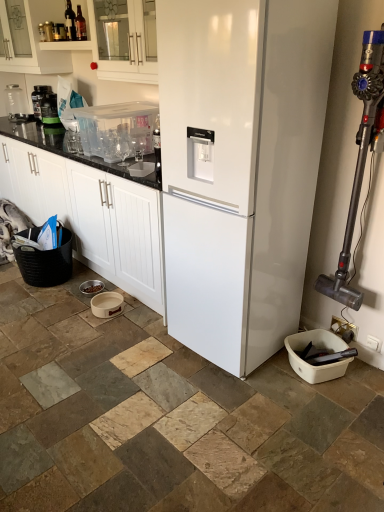
What do you see at coordinates (15, 103) in the screenshot?
I see `clear plastic container at upper left, acting as the seventh appliance starting from the right` at bounding box center [15, 103].

This screenshot has height=512, width=384. What are the coordinates of `white plastic bucket at lower right, positioned as the 2th appliance in front-to-back order` in the screenshot? It's located at (320, 345).

Identify the location of matte black coffee maker at left, placed as the fifth appliance when sorted from right to left. (49, 110).

What do you see at coordinates (49, 110) in the screenshot? I see `matte black coffee maker at left, which ranks as the third appliance in back-to-front order` at bounding box center [49, 110].

You are a GUI agent. You are given a task and a screenshot of the screen. Output one action in this format:
    pyautogui.click(x=<x>, y=<y>)
    Task: Click on the transparent plastic container at upper left, placed as the fifth appliance when sorted from left to right
    The image size is (384, 512).
    Given the screenshot: What is the action you would take?
    pyautogui.click(x=117, y=129)

Is black woven basket at lower left positioned beyond the bounds of matte glass cabinet at upper left, which ranks as the third cabinetry in bottom-to-top order?

Yes, black woven basket at lower left is located beyond the bounds of matte glass cabinet at upper left, which ranks as the third cabinetry in bottom-to-top order.

Measure the distance between black woven basket at lower left and matte glass cabinet at upper left, which appears as the first cabinetry when viewed from the top.

black woven basket at lower left is 1.66 meters from matte glass cabinet at upper left, which appears as the first cabinetry when viewed from the top.

Looking at this image, which is closer, (35, 230) or (29, 56)?

Point (35, 230) is closer to the camera than point (29, 56).

Is black woven basket at lower left in front of or behind matte glass cabinet at upper left, which appears as the first cabinetry when viewed from the top, in the image?

Visually, black woven basket at lower left is located in front of matte glass cabinet at upper left, which appears as the first cabinetry when viewed from the top.

Does beige ceramic bowl at lower center, positioned as the fourth appliance in back-to-front order, have a greater height compared to dark glass bottle at upper left?

In fact, beige ceramic bowl at lower center, positioned as the fourth appliance in back-to-front order, may be shorter than dark glass bottle at upper left.

Does beige ceramic bowl at lower center, positioned as the fourth appliance in back-to-front order, have a greater width compared to dark glass bottle at upper left?

Yes.

What's the angular difference between beige ceramic bowl at lower center, which is the fourth appliance in right-to-left order, and dark glass bottle at upper left's facing directions?

0.285 degrees.

Is beige ceramic bowl at lower center, positioned as the fourth appliance in back-to-front order, next to dark glass bottle at upper left and touching it?

There is a gap between beige ceramic bowl at lower center, positioned as the fourth appliance in back-to-front order, and dark glass bottle at upper left.

Is metallic gray vacuum cleaner at right, the 1th appliance in the front-to-back sequence, facing towards matte black protein powder container at upper left, the 6th appliance when ordered from right to left?

No, metallic gray vacuum cleaner at right, the 1th appliance in the front-to-back sequence, is not facing towards matte black protein powder container at upper left, the 6th appliance when ordered from right to left.

Can you confirm if metallic gray vacuum cleaner at right, arranged as the 7th appliance when viewed from the left, is positioned to the right of matte black protein powder container at upper left, which appears as the sixth appliance when viewed from the front?

Yes, metallic gray vacuum cleaner at right, arranged as the 7th appliance when viewed from the left, is to the right of matte black protein powder container at upper left, which appears as the sixth appliance when viewed from the front.

Considering the relative sizes of metallic gray vacuum cleaner at right, which ranks as the first appliance in right-to-left order, and matte black protein powder container at upper left, the 6th appliance when ordered from right to left, in the image provided, is metallic gray vacuum cleaner at right, which ranks as the first appliance in right-to-left order, taller than matte black protein powder container at upper left, the 6th appliance when ordered from right to left,?

Yes, metallic gray vacuum cleaner at right, which ranks as the first appliance in right-to-left order, is taller than matte black protein powder container at upper left, the 6th appliance when ordered from right to left.

From a real-world perspective, is metallic gray vacuum cleaner at right, arranged as the 7th appliance when viewed from the left, positioned above or below matte black protein powder container at upper left, the 6th appliance when ordered from right to left?

metallic gray vacuum cleaner at right, arranged as the 7th appliance when viewed from the left, is situated lower than matte black protein powder container at upper left, the 6th appliance when ordered from right to left, in the real world.

Where is `refrigerator in front of the transparent plastic container at upper left, arranged as the third appliance when viewed from the right`? The image size is (384, 512). refrigerator in front of the transparent plastic container at upper left, arranged as the third appliance when viewed from the right is located at coordinates (240, 167).

Is transparent plastic container at upper left, arranged as the third appliance when viewed from the right, wider or thinner than white glossy refrigerator at center?

transparent plastic container at upper left, arranged as the third appliance when viewed from the right, is thinner than white glossy refrigerator at center.

Is point (107, 114) closer or farther from the camera than point (187, 311)?

Point (107, 114) appears to be farther away from the viewer than point (187, 311).

Between transparent plastic container at upper left, arranged as the fifth appliance when viewed from the back, and white glossy refrigerator at center, which one has more height?

white glossy refrigerator at center.

Is matte glass cabinet at upper left, which ranks as the third cabinetry in bottom-to-top order, looking in the opposite direction of white glossy refrigerator at center?

No, matte glass cabinet at upper left, which ranks as the third cabinetry in bottom-to-top order, is not facing away from white glossy refrigerator at center.

In terms of height, does matte glass cabinet at upper left, which ranks as the third cabinetry in bottom-to-top order, look taller or shorter compared to white glossy refrigerator at center?

Considering their sizes, matte glass cabinet at upper left, which ranks as the third cabinetry in bottom-to-top order, has less height than white glossy refrigerator at center.

From the image's perspective, is matte glass cabinet at upper left, which appears as the first cabinetry when viewed from the top, located above white glossy refrigerator at center?

Yes, from the image's perspective, matte glass cabinet at upper left, which appears as the first cabinetry when viewed from the top, is above white glossy refrigerator at center.

Can you tell me how much matte glass cabinet at upper left, which ranks as the third cabinetry in bottom-to-top order, and white glossy refrigerator at center differ in facing direction?

They differ by 0.000142 degrees in their facing directions.

From a real-world perspective, does black woven basket at lower left stand above clear plastic container at upper left, acting as the seventh appliance starting from the right?

No, from a real-world perspective, black woven basket at lower left is not above clear plastic container at upper left, acting as the seventh appliance starting from the right.

Is black woven basket at lower left behind clear plastic container at upper left, the 1th appliance positioned from the left?

No, black woven basket at lower left is in front of clear plastic container at upper left, the 1th appliance positioned from the left.

From the picture: Is black woven basket at lower left positioned beyond the bounds of clear plastic container at upper left, the 1th appliance positioned from the left?

black woven basket at lower left lies outside clear plastic container at upper left, the 1th appliance positioned from the left,'s area.

How different are the orientations of black woven basket at lower left and clear plastic container at upper left, acting as the seventh appliance starting from the right, in degrees?

12.9 degrees.

Looking at this image, is dark glass bottle at upper left positioned far away from transparent plastic container at upper left, the third appliance viewed from the front?

No, dark glass bottle at upper left is in close proximity to transparent plastic container at upper left, the third appliance viewed from the front.

How far apart are dark glass bottle at upper left and transparent plastic container at upper left, arranged as the third appliance when viewed from the right?

dark glass bottle at upper left and transparent plastic container at upper left, arranged as the third appliance when viewed from the right, are 32.11 inches apart from each other.

From the image's perspective, is dark glass bottle at upper left above or below transparent plastic container at upper left, arranged as the fifth appliance when viewed from the back?

dark glass bottle at upper left is situated higher than transparent plastic container at upper left, arranged as the fifth appliance when viewed from the back, in the image.

You are a GUI agent. You are given a task and a screenshot of the screen. Output one action in this format:
    pyautogui.click(x=<x>, y=<y>)
    Task: Click on the basket in front of the matte glass cabinet at upper left, which ranks as the third cabinetry in bottom-to-top order
    The image size is (384, 512).
    Given the screenshot: What is the action you would take?
    pyautogui.click(x=46, y=262)

From a real-world perspective, starting from the dark glass bottle at upper left, which appliance is the 7th one below it? Please provide its 2D coordinates.

[(107, 304)]

Which object lies nearer to the anchor point dark glass bottle at upper left, metallic gray vacuum cleaner at right, the seventh appliance when ordered from back to front, or clear plastic container at upper left, the 1th appliance positioned from the left?

clear plastic container at upper left, the 1th appliance positioned from the left, lies closer to dark glass bottle at upper left than the other object.

From the picture: Which object lies nearer to the anchor point black woven basket at lower left, white glossy refrigerator at center or metallic gray vacuum cleaner at right, which ranks as the first appliance in right-to-left order?

Among the two, white glossy refrigerator at center is located nearer to black woven basket at lower left.

Estimate the real-world distances between objects in this image. Which object is further from clear plastic container at upper left, which is the 1th appliance in back-to-front order, beige ceramic bowl at lower center, which is the fourth appliance in right-to-left order, or matte glass cabinet at upper left, which ranks as the third cabinetry in bottom-to-top order?

beige ceramic bowl at lower center, which is the fourth appliance in right-to-left order, lies further to clear plastic container at upper left, which is the 1th appliance in back-to-front order, than the other object.

Which object lies further to the anchor point metallic gray vacuum cleaner at right, the 1th appliance in the front-to-back sequence, matte glass cabinet at upper left, which appears as the first cabinetry when viewed from the top, or dark glass bottle at upper left?

matte glass cabinet at upper left, which appears as the first cabinetry when viewed from the top, is further to metallic gray vacuum cleaner at right, the 1th appliance in the front-to-back sequence.

Which object lies further to the anchor point dark glass bottle at upper left, white glossy refrigerator at center or black woven basket at lower left?

white glossy refrigerator at center is positioned further to the anchor dark glass bottle at upper left.

Which object lies further to the anchor point beige ceramic bowl at lower center, which ranks as the 4th appliance in left-to-right order, dark glass bottle at upper left or black woven basket at lower left?

dark glass bottle at upper left is positioned further to the anchor beige ceramic bowl at lower center, which ranks as the 4th appliance in left-to-right order.

Looking at this image, based on their spatial positions, is matte black protein powder container at upper left, the 2th appliance positioned from the left, or black woven basket at lower left further from clear plastic container at upper left, marked as the 7th appliance in a front-to-back arrangement?

black woven basket at lower left is further to clear plastic container at upper left, marked as the 7th appliance in a front-to-back arrangement.

When comparing their distances from clear plastic container at upper left, marked as the 7th appliance in a front-to-back arrangement, does dark glass bottle at upper left or beige ceramic bowl at lower center, which ranks as the 4th appliance in left-to-right order, seem further?

beige ceramic bowl at lower center, which ranks as the 4th appliance in left-to-right order, is further to clear plastic container at upper left, marked as the 7th appliance in a front-to-back arrangement.

Locate an element on the screen. refrigerator between black woven basket at lower left and white plastic bucket at lower right, the 6th appliance from the back, in the horizontal direction is located at coordinates (240, 167).

This screenshot has width=384, height=512. Find the location of `cabinetry between transparent plastic container at upper left, arranged as the third appliance when viewed from the right, and black woven basket at lower left vertically`. cabinetry between transparent plastic container at upper left, arranged as the third appliance when viewed from the right, and black woven basket at lower left vertically is located at coordinates (92, 215).

The width and height of the screenshot is (384, 512). I want to click on basket between dark glass bottle at upper left and white plastic bucket at lower right, the 2th appliance from the right, in the vertical direction, so click(x=46, y=262).

Locate an element on the screen. cabinetry located between transparent plastic container at upper left, the third appliance viewed from the front, and metallic gray vacuum cleaner at right, arranged as the 7th appliance when viewed from the left, in the left-right direction is located at coordinates 123,41.